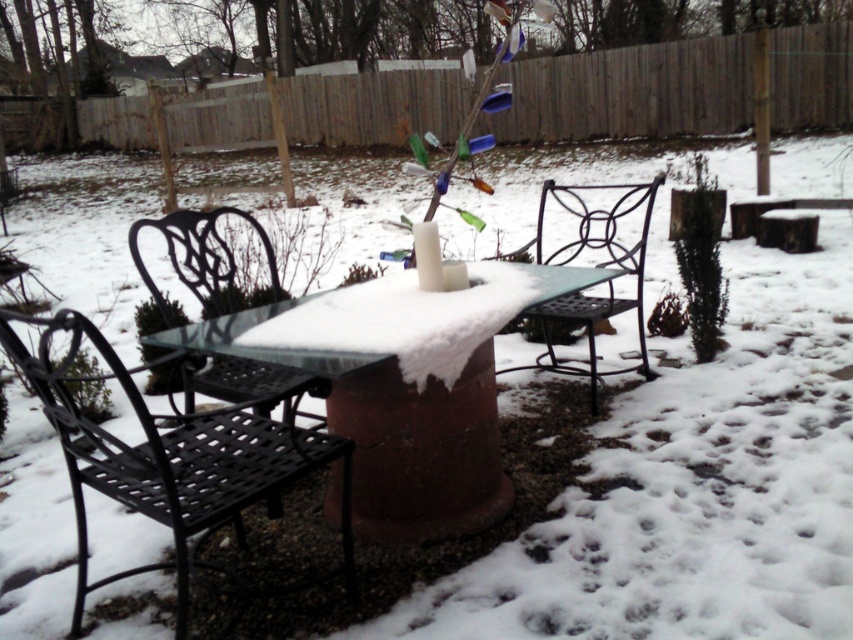
Question: Does black wrought iron chair at lower left have a larger size compared to black wrought iron chair at center?

Choices:
 (A) yes
 (B) no

Answer: (A)

Question: Does snow-covered glass table at center appear on the left side of black wrought iron chair at center?

Choices:
 (A) yes
 (B) no

Answer: (A)

Question: Is black wrought iron chair at lower left positioned behind snow-covered glass table at center?

Choices:
 (A) no
 (B) yes

Answer: (A)

Question: Which is farther from the black wrought iron chair at center?

Choices:
 (A) black wrought iron chair at lower left
 (B) snow-covered glass table at center
 (C) black wrought iron chair at left

Answer: (A)

Question: Which of the following is the farthest from the observer?

Choices:
 (A) (252, 298)
 (B) (611, 314)
 (C) (64, 401)
 (D) (526, 268)

Answer: (A)

Question: Which of the following is the closest to the observer?

Choices:
 (A) snow-covered glass table at center
 (B) black wrought iron chair at lower left
 (C) black wrought iron chair at left

Answer: (B)